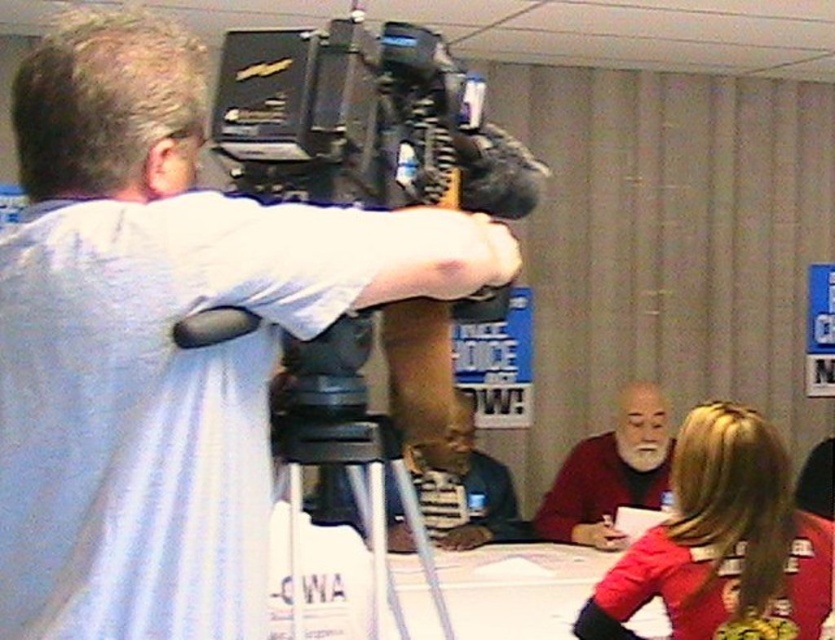
Question: Does red fabric shirt at lower right have a greater width compared to bearded man at center?

Choices:
 (A) no
 (B) yes

Answer: (B)

Question: Is matte black camera at upper left positioned at the back of red fabric shirt at lower right?

Choices:
 (A) yes
 (B) no

Answer: (B)

Question: Which point is farther from the camera taking this photo?

Choices:
 (A) (777, 460)
 (B) (544, 520)
 (C) (367, 449)
 (D) (185, 182)

Answer: (B)

Question: Among these objects, which one is nearest to the camera?

Choices:
 (A) black plastic tripod at center
 (B) red fabric shirt at lower right

Answer: (A)

Question: Is black plastic tripod at center to the right of bearded man at center from the viewer's perspective?

Choices:
 (A) no
 (B) yes

Answer: (A)

Question: Which object is closer to the camera taking this photo?

Choices:
 (A) red fabric shirt at lower right
 (B) matte black camera at upper left
 (C) black plastic tripod at center
 (D) bearded man at center

Answer: (B)